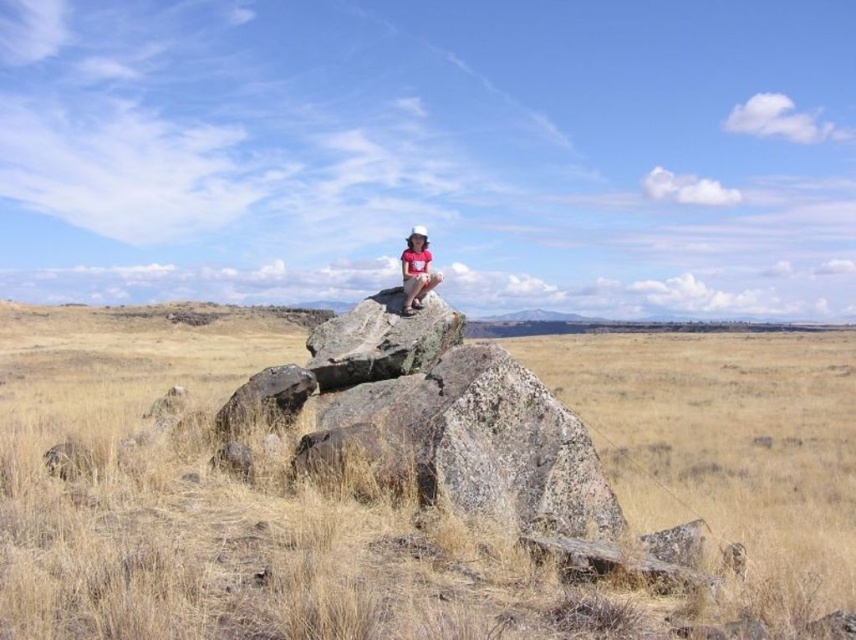
Between dry grass at center and matte pink shirt at center, which one has more height?

With more height is dry grass at center.

Is dry grass at center bigger than matte pink shirt at center?

Indeed, dry grass at center has a larger size compared to matte pink shirt at center.

Which is in front, point (554, 513) or point (424, 244)?

Point (554, 513)

Where is `dry grass at center`? dry grass at center is located at coordinates (415, 484).